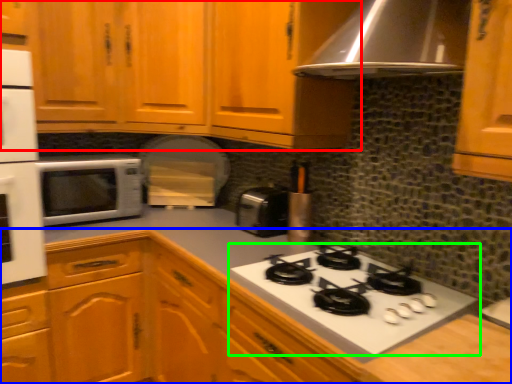
Question: Estimate the real-world distances between objects in this image. Which object is farther from cabinetry (highlighted by a red box), cabinetry (highlighted by a blue box) or gas stove (highlighted by a green box)?

Choices:
 (A) cabinetry
 (B) gas stove

Answer: (B)